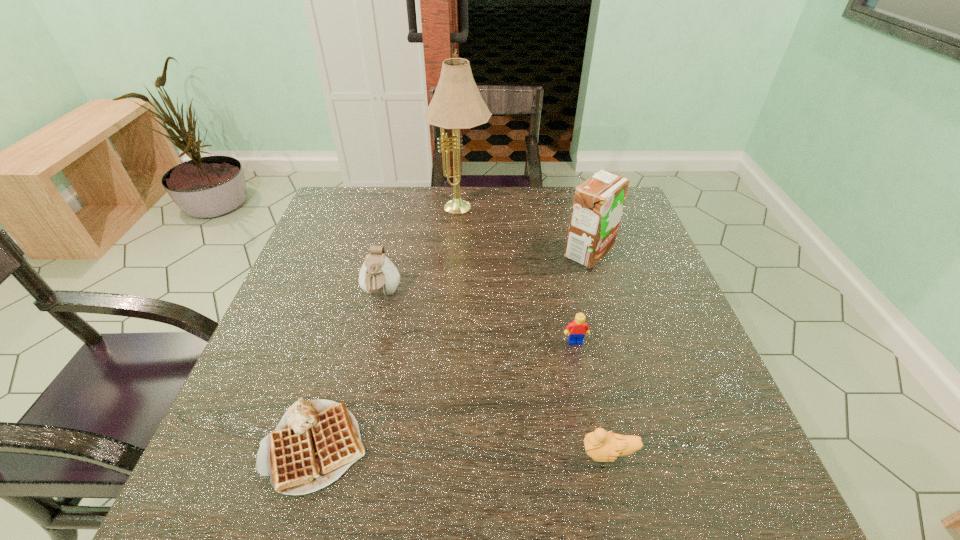
I want to click on free region located 0.060m on the straw side of the carton, so click(x=540, y=253).

The width and height of the screenshot is (960, 540). What are the coordinates of `free space located on the straw side of the carton` in the screenshot? It's located at (454, 253).

Locate an element on the screen. The image size is (960, 540). free space located 0.360m on the straw side of the carton is located at coordinates (428, 253).

I want to click on free location located 0.070m on the front-facing side of the fourth nearest object, so click(372, 335).

You are a GUI agent. You are given a task and a screenshot of the screen. Output one action in this format:
    pyautogui.click(x=<x>, y=<y>)
    Task: Click on the vacant space located 0.170m on the face of the Lego
    The height and width of the screenshot is (540, 960).
    Given the screenshot: What is the action you would take?
    click(x=590, y=417)

Find the location of a particular element. Image resolution: width=960 pixels, height=540 pixels. free space located 0.360m on the face of the duckling is located at coordinates click(373, 454).

You are a GUI agent. You are given a task and a screenshot of the screen. Output one action in this format:
    pyautogui.click(x=<x>, y=<y>)
    Task: Click on the vacant position located on the face of the duckling
    The image size is (960, 540).
    Given the screenshot: What is the action you would take?
    pyautogui.click(x=420, y=454)

Image resolution: width=960 pixels, height=540 pixels. I want to click on vacant area located 0.330m on the face of the duckling, so click(391, 454).

Find the location of `vacant space located on the right of the waffle`. vacant space located on the right of the waffle is located at coordinates [x=430, y=446].

Identify the location of object located at the far edge. (457, 104).